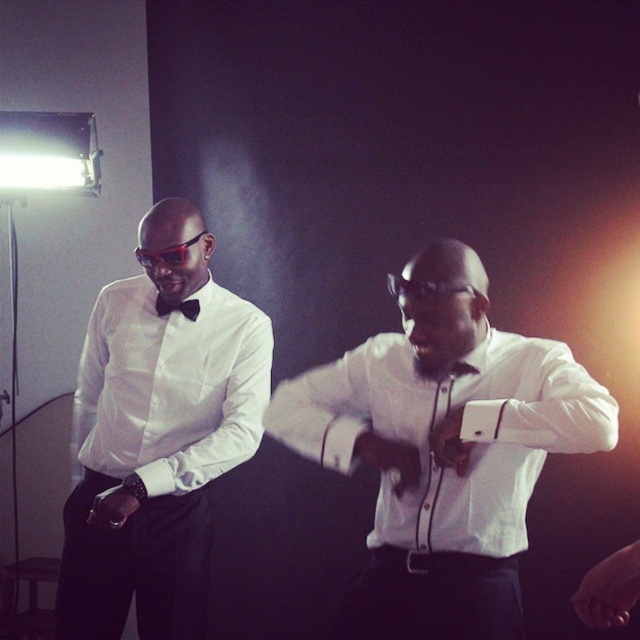
Question: Considering the relative positions of white satin bow tie at left and white satin shirt at left in the image provided, where is white satin bow tie at left located with respect to white satin shirt at left?

Choices:
 (A) below
 (B) above

Answer: (A)

Question: Which point is farther to the camera?

Choices:
 (A) white satin bow tie at left
 (B) white satin shirt at center
 (C) black plastic goggles at left
 (D) white satin shirt at left

Answer: (C)

Question: Is white satin bow tie at left above black satin bow tie at left?

Choices:
 (A) yes
 (B) no

Answer: (B)

Question: Is white satin bow tie at left to the right of black plastic goggles at left from the viewer's perspective?

Choices:
 (A) no
 (B) yes

Answer: (A)

Question: Estimate the real-world distances between objects in this image. Which object is farther from the black satin bow tie at left?

Choices:
 (A) black plastic goggles at left
 (B) white satin shirt at center
 (C) white satin shirt at left

Answer: (B)

Question: Which object is the closest to the white satin bow tie at left?

Choices:
 (A) white satin shirt at left
 (B) black plastic goggles at left

Answer: (A)